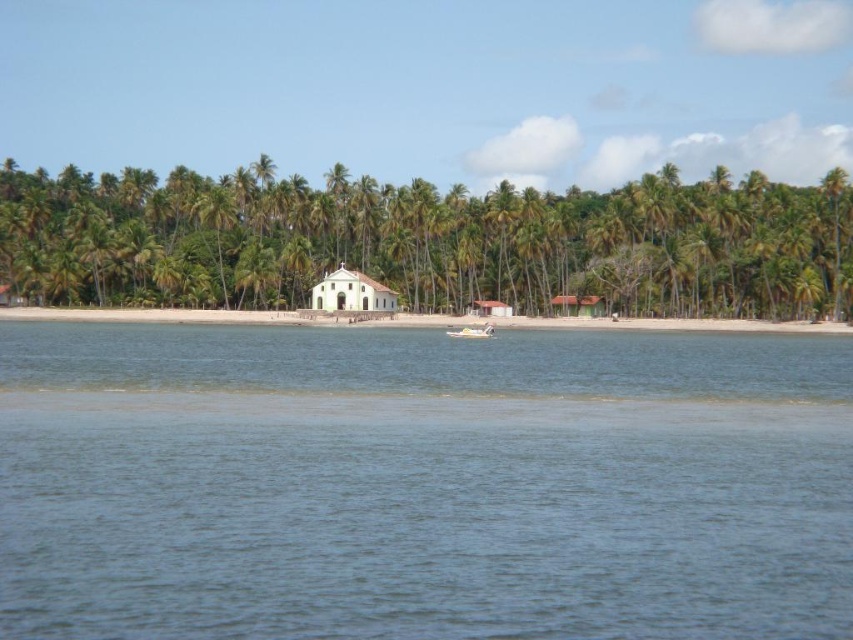
You are standing at the edge of the beach looking towards the white building with a red roof. There are two points marked in the image. The first point is at coordinate (682, 330) and the second point is at coordinate (349, 296). Which point is closer to you?

Point (682, 330) is closer to you than point (349, 296).

You are standing on the white sand beach at center and want to reach the white plastic boat at center. Which direction should you walk to get there?

You should walk to the right because the white plastic boat at center is on the right side of the white sand beach at center.